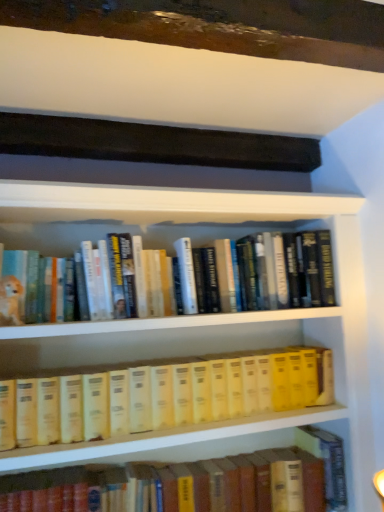
Question: From a real-world perspective, is yellow hardcover books at center, the first book positioned from the top, positioned above or below hardcover book at center, which is the 1th book in bottom-to-top order?

Choices:
 (A) above
 (B) below

Answer: (A)

Question: Is yellow hardcover books at center, which is counted as the second book, starting from the bottom, in front of or behind hardcover book at center, which is the 1th book in bottom-to-top order, in the image?

Choices:
 (A) behind
 (B) front

Answer: (B)

Question: Is yellow hardcover books at center, the first book positioned from the top, wider or thinner than hardcover book at center, which is the 1th book in bottom-to-top order?

Choices:
 (A) thin
 (B) wide

Answer: (B)

Question: From a real-world perspective, is hardcover book at center, which is the 1th book in bottom-to-top order, positioned above or below yellow hardcover books at center, the first book positioned from the top?

Choices:
 (A) below
 (B) above

Answer: (A)

Question: Do you think hardcover book at center, which is the 1th book in bottom-to-top order, is within yellow hardcover books at center, the first book positioned from the top, or outside of it?

Choices:
 (A) inside
 (B) outside

Answer: (B)

Question: Considering the positions of point (288, 498) and point (316, 373), is point (288, 498) closer or farther from the camera than point (316, 373)?

Choices:
 (A) closer
 (B) farther

Answer: (A)

Question: Is hardcover book at center, which is the 1th book in bottom-to-top order, wider or thinner than yellow hardcover books at center, which is counted as the second book, starting from the bottom?

Choices:
 (A) wide
 (B) thin

Answer: (B)